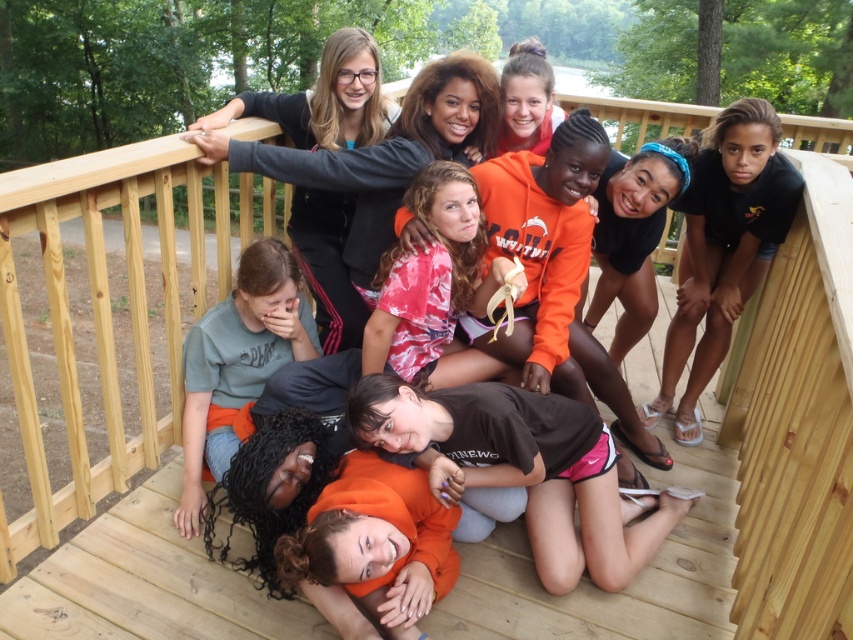
You are standing at the origin of a coordinate system placed at the bottom left corner of the deck. You see a point marked at coordinates (380, 540). What object is located at that point?

The point at coordinates (380, 540) corresponds to the orange fleece sweatshirt at center.

You are standing at the edge of the deck and want to take a photo of the black matte shirt at upper right. If your camera has a maximum focus range of 7 feet, will you be able to capture it clearly?

The black matte shirt at upper right is 7.50 feet away from the camera, which exceeds the maximum focus range of 7 feet. Therefore, you won